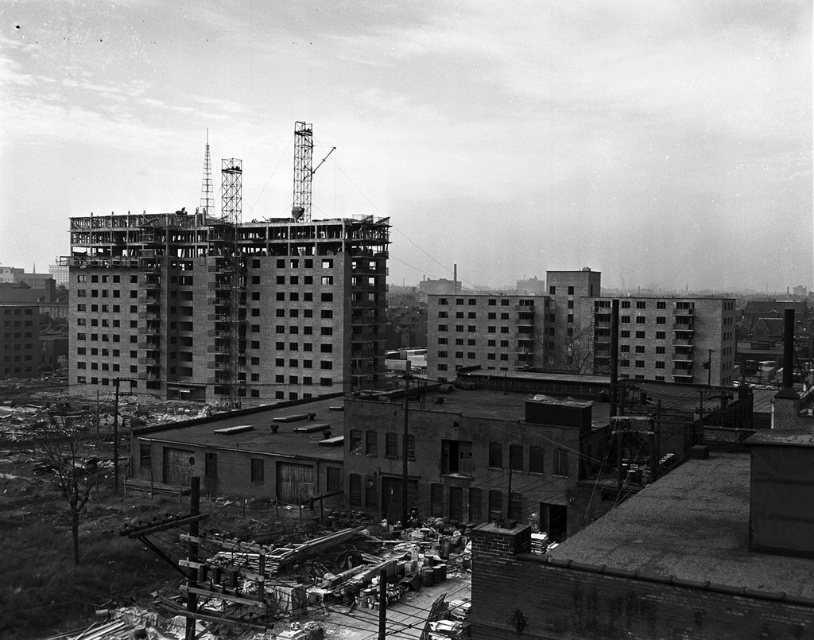
Question: In this image, where is exposed concrete foundation at center located relative to exposed concrete building at center?

Choices:
 (A) below
 (B) above

Answer: (A)

Question: Is exposed concrete foundation at center bigger than exposed concrete building at center?

Choices:
 (A) no
 (B) yes

Answer: (A)

Question: Among these objects, which one is nearest to the camera?

Choices:
 (A) exposed concrete foundation at center
 (B) exposed concrete building at center

Answer: (A)

Question: Can you confirm if exposed concrete foundation at center is wider than exposed concrete building at center?

Choices:
 (A) yes
 (B) no

Answer: (B)

Question: Which object appears closest to the camera in this image?

Choices:
 (A) exposed concrete building at center
 (B) exposed concrete foundation at center

Answer: (B)